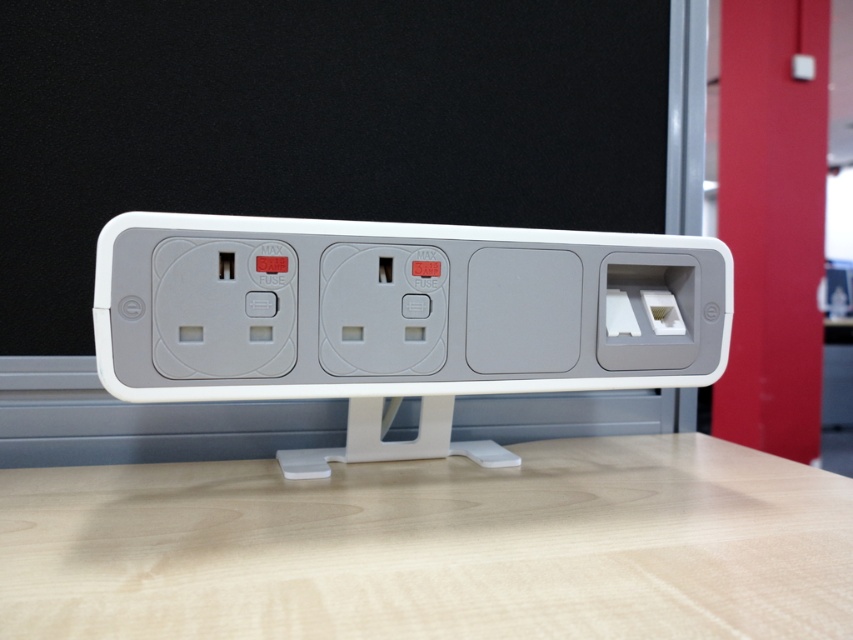
Question: Which of the following is the farthest from the observer?

Choices:
 (A) white plastic power strip at center
 (B) light wood table at center

Answer: (A)

Question: Is light wood table at center smaller than white plastic power strip at center?

Choices:
 (A) yes
 (B) no

Answer: (B)

Question: Among these objects, which one is farthest from the camera?

Choices:
 (A) white plastic power strip at center
 (B) light wood table at center

Answer: (A)

Question: Which of the following is the farthest from the observer?

Choices:
 (A) white plastic power strip at center
 (B) light wood table at center

Answer: (A)

Question: Does light wood table at center have a larger size compared to white plastic power strip at center?

Choices:
 (A) no
 (B) yes

Answer: (B)

Question: Is light wood table at center to the left of white plastic power strip at center from the viewer's perspective?

Choices:
 (A) no
 (B) yes

Answer: (A)